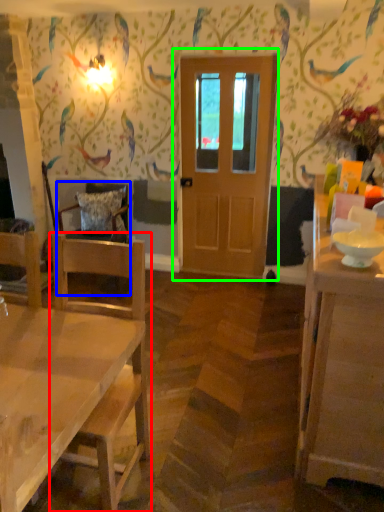
Question: Which is nearer to the chair (highlighted by a red box)? chair (highlighted by a blue box) or door (highlighted by a green box).

Choices:
 (A) chair
 (B) door

Answer: (A)